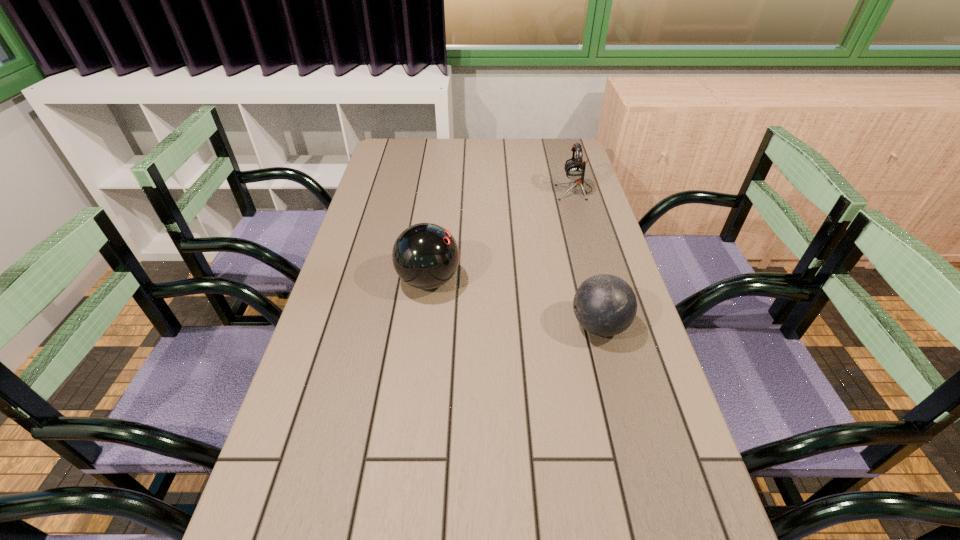
I want to click on the farthest object, so click(575, 168).

Locate an element on the screen. Image resolution: width=960 pixels, height=540 pixels. the left bowling ball is located at coordinates (425, 255).

Locate an element on the screen. The width and height of the screenshot is (960, 540). the leftmost object is located at coordinates (425, 255).

Find the location of a particular element. Image resolution: width=960 pixels, height=540 pixels. the nearest object is located at coordinates tap(605, 305).

Identify the location of the shortest object. This screenshot has width=960, height=540. (605, 305).

You are a GUI agent. You are given a task and a screenshot of the screen. Output one action in this format:
    pyautogui.click(x=<x>, y=<y>)
    Task: Click on the vacant space located 0.110m on the front of the farthest object
    The height and width of the screenshot is (540, 960).
    Given the screenshot: What is the action you would take?
    pyautogui.click(x=583, y=220)

You are a GUI agent. You are given a task and a screenshot of the screen. Output one action in this format:
    pyautogui.click(x=<x>, y=<y>)
    Task: Click on the blank area located on the surface of the farther bowling ball near the finger holes
    This screenshot has width=960, height=540.
    Given the screenshot: What is the action you would take?
    pyautogui.click(x=516, y=280)

Locate an element on the screen. Image resolution: width=960 pixels, height=540 pixels. vacant space located 0.150m on the grip area of the right bowling ball is located at coordinates (508, 326).

This screenshot has width=960, height=540. Find the location of `blank space located on the grip area of the right bowling ball`. blank space located on the grip area of the right bowling ball is located at coordinates (451, 326).

Identify the location of free space located 0.280m on the grip area of the right bowling ball. (455, 326).